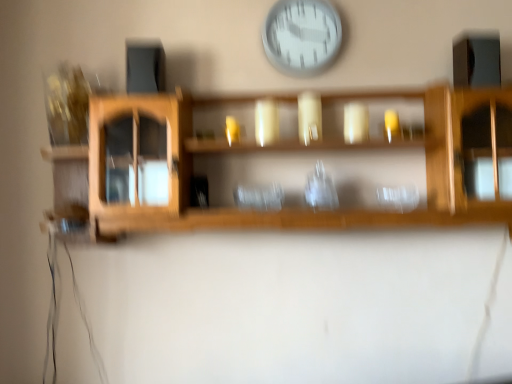
Describe the element at coordinates (320, 189) in the screenshot. I see `transparent glass vase at center` at that location.

This screenshot has width=512, height=384. Identify the location of white plastic wall clock at upper center. (302, 36).

Would you say transparent glass vase at center is outside wooden shelf at center?

No, transparent glass vase at center is inside wooden shelf at center's boundary.

From the picture: What's the angular difference between transparent glass vase at center and wooden shelf at center's facing directions?

There is a 0.221-degree angle between the facing directions of transparent glass vase at center and wooden shelf at center.

From a real-world perspective, is transparent glass vase at center positioned under wooden shelf at center based on gravity?

Correct, in the physical world, transparent glass vase at center is lower than wooden shelf at center.

Considering the relative sizes of transparent glass vase at center and wooden shelf at center in the image provided, is transparent glass vase at center bigger than wooden shelf at center?

Actually, transparent glass vase at center might be smaller than wooden shelf at center.

Does wooden shelf at center have a lesser width compared to white plastic wall clock at upper center?

In fact, wooden shelf at center might be wider than white plastic wall clock at upper center.

Between point (96, 166) and point (340, 27), which one is positioned behind?

Positioned behind is point (340, 27).

Is wooden shelf at center inside the boundaries of white plastic wall clock at upper center, or outside?

wooden shelf at center is located beyond the bounds of white plastic wall clock at upper center.

Between wooden shelf at center and transparent glass vase at center, which one has smaller width?

transparent glass vase at center.

How different are the orientations of wooden shelf at center and transparent glass vase at center in degrees?

0.221 degrees separate the facing orientations of wooden shelf at center and transparent glass vase at center.

Is wooden shelf at center not near transparent glass vase at center?

No.

Would you say wooden shelf at center contains transparent glass vase at center?

Yes, wooden shelf at center contains transparent glass vase at center.

Locate an element on the screen. The width and height of the screenshot is (512, 384). glass vase located underneath the white plastic wall clock at upper center (from a real-world perspective) is located at coordinates (320, 189).

Is white plastic wall clock at upper center positioned in front of transparent glass vase at center?

No.

Is white plastic wall clock at upper center touching transparent glass vase at center?

No, white plastic wall clock at upper center is not beside transparent glass vase at center.

Does white plastic wall clock at upper center come behind wooden shelf at center?

Yes.

Which is behind, point (332, 57) or point (175, 134)?

The point (332, 57) is farther.

Is white plastic wall clock at upper center positioned far away from wooden shelf at center?

No, white plastic wall clock at upper center is not far away from wooden shelf at center.

Is the depth of transparent glass vase at center less than that of white plastic wall clock at upper center?

Yes, transparent glass vase at center is closer to the viewer.

Based on the photo, based on their sizes in the image, would you say transparent glass vase at center is bigger or smaller than white plastic wall clock at upper center?

Clearly, transparent glass vase at center is smaller in size than white plastic wall clock at upper center.

How far apart are transparent glass vase at center and white plastic wall clock at upper center?

Result: transparent glass vase at center is 15.87 inches away from white plastic wall clock at upper center.

From the image's perspective, which one is positioned lower, transparent glass vase at center or white plastic wall clock at upper center?

transparent glass vase at center is shown below in the image.

Where is `shelf in front of the transparent glass vase at center`? This screenshot has height=384, width=512. shelf in front of the transparent glass vase at center is located at coordinates (275, 151).

Locate an element on the screen. shelf on the left of white plastic wall clock at upper center is located at coordinates (275, 151).

Looking at this image, based on their spatial positions, is wooden shelf at center or transparent glass vase at center further from white plastic wall clock at upper center?

transparent glass vase at center is further to white plastic wall clock at upper center.

Considering their positions, is transparent glass vase at center positioned closer to white plastic wall clock at upper center than wooden shelf at center?

The object closer to white plastic wall clock at upper center is wooden shelf at center.

When comparing their distances from wooden shelf at center, does white plastic wall clock at upper center or transparent glass vase at center seem closer?

transparent glass vase at center.

Which object lies nearer to the anchor point wooden shelf at center, transparent glass vase at center or white plastic wall clock at upper center?

Among the two, transparent glass vase at center is located nearer to wooden shelf at center.

Looking at the image, which one is located closer to transparent glass vase at center, wooden shelf at center or white plastic wall clock at upper center?

Among the two, wooden shelf at center is located nearer to transparent glass vase at center.

Estimate the real-world distances between objects in this image. Which object is further from transparent glass vase at center, white plastic wall clock at upper center or wooden shelf at center?

The object further to transparent glass vase at center is white plastic wall clock at upper center.

The width and height of the screenshot is (512, 384). Identify the location of shelf between white plastic wall clock at upper center and transparent glass vase at center in the vertical direction. (275, 151).